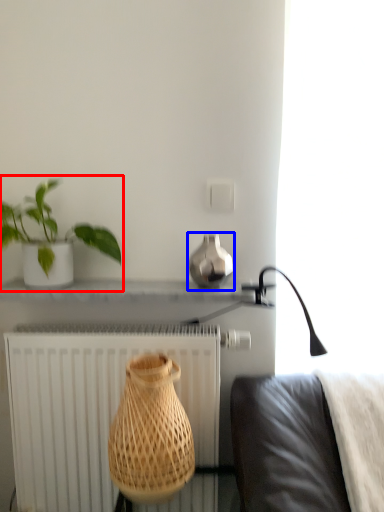
Question: Which object appears closest to the camera in this image, houseplant (highlighted by a red box) or vase (highlighted by a blue box)?

Choices:
 (A) houseplant
 (B) vase

Answer: (A)